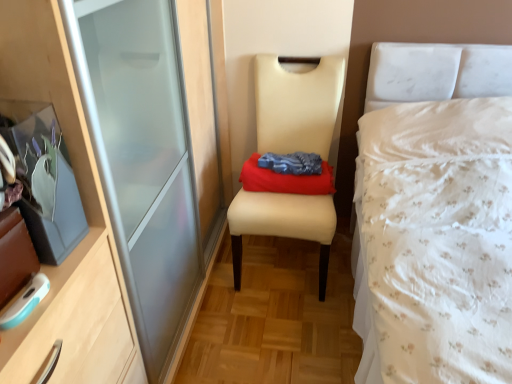
At what (x,y) coordinates should I click in order to perform the action: click on white floral fabric bed at right. Please return your answer as a coordinate pair (x, y). This screenshot has width=512, height=384. Looking at the image, I should click on (435, 217).

From a real-world perspective, which is physically below, red cotton cloth at center or white floral fabric bed at right?

white floral fabric bed at right.

Is red cotton cloth at center facing towards white floral fabric bed at right?

No, red cotton cloth at center is not turned towards white floral fabric bed at right.

Which is more distant, (262,191) or (449,269)?

Positioned behind is point (262,191).

Would you say red cotton cloth at center is a long distance from white floral fabric bed at right?

No, red cotton cloth at center is not far from white floral fabric bed at right.

Considering the relative positions of white floral fabric bed at right and beige leather chair at center in the image provided, is white floral fabric bed at right to the left or to the right of beige leather chair at center?

Based on their positions, white floral fabric bed at right is located to the right of beige leather chair at center.

Is white floral fabric bed at right in front of beige leather chair at center?

Yes, it is.

Consider the image. Which is in front, white floral fabric bed at right or red cotton cloth at center?

white floral fabric bed at right is in front.

In the scene shown: From a real-world perspective, is white floral fabric bed at right on top of red cotton cloth at center?

No, from a real-world perspective, white floral fabric bed at right is not over red cotton cloth at center

Can you see white floral fabric bed at right touching red cotton cloth at center?

They are not placed beside each other.

This screenshot has width=512, height=384. In order to click on bed below the red cotton cloth at center (from a real-world perspective) in this screenshot , I will do pos(435,217).

From the image's perspective, is red cotton cloth at center located above or below beige leather chair at center?

red cotton cloth at center is above beige leather chair at center.

Is red cotton cloth at center located outside beige leather chair at center?

No, most part of red cotton cloth at center lies within beige leather chair at center.

Is red cotton cloth at center shorter than beige leather chair at center?

Indeed, red cotton cloth at center has a lesser height compared to beige leather chair at center.

Considering the sizes of objects beige leather chair at center and white floral fabric bed at right in the image provided, who is smaller, beige leather chair at center or white floral fabric bed at right?

With smaller size is beige leather chair at center.

Considering the relative sizes of beige leather chair at center and white floral fabric bed at right in the image provided, is beige leather chair at center taller than white floral fabric bed at right?

No.

Is beige leather chair at center oriented away from white floral fabric bed at right?

beige leather chair at center does not have its back to white floral fabric bed at right.

Find the location of a particular element. bed in front of the beige leather chair at center is located at coordinates click(x=435, y=217).

Which object is thinner, beige leather chair at center or red cotton cloth at center?

With smaller width is red cotton cloth at center.

Which point is more forward, (302,220) or (305,179)?

The point (302,220) is in front.

From a real-world perspective, between beige leather chair at center and red cotton cloth at center, who is vertically higher?

red cotton cloth at center, from a real-world perspective.

Can you tell me how much beige leather chair at center and red cotton cloth at center differ in facing direction?

The facing directions of beige leather chair at center and red cotton cloth at center are 0.449 degrees apart.

Locate an element on the screen. clothing located behind the white floral fabric bed at right is located at coordinates (285, 180).

Find the location of a particular element. This screenshot has height=384, width=512. bed above the beige leather chair at center (from a real-world perspective) is located at coordinates (435, 217).

Which object lies further to the anchor point white floral fabric bed at right, beige leather chair at center or red cotton cloth at center?

beige leather chair at center lies further to white floral fabric bed at right than the other object.

Consider the image. When comparing their distances from beige leather chair at center, does white floral fabric bed at right or red cotton cloth at center seem further?

white floral fabric bed at right.

Which object lies further to the anchor point red cotton cloth at center, beige leather chair at center or white floral fabric bed at right?

white floral fabric bed at right.

Based on their spatial positions, is red cotton cloth at center or beige leather chair at center closer to white floral fabric bed at right?

Based on the image, red cotton cloth at center appears to be nearer to white floral fabric bed at right.

Considering their positions, is white floral fabric bed at right positioned further to red cotton cloth at center than beige leather chair at center?

white floral fabric bed at right is further to red cotton cloth at center.

Which object lies nearer to the anchor point beige leather chair at center, red cotton cloth at center or white floral fabric bed at right?

red cotton cloth at center.

Image resolution: width=512 pixels, height=384 pixels. I want to click on chair positioned between white floral fabric bed at right and red cotton cloth at center from near to far, so click(297, 105).